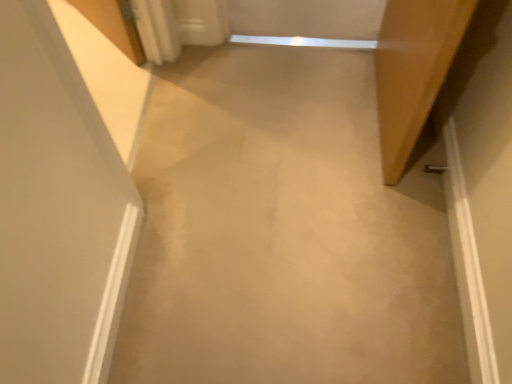
The height and width of the screenshot is (384, 512). I want to click on free location above beige carpet at center (from a real-world perspective), so click(x=271, y=192).